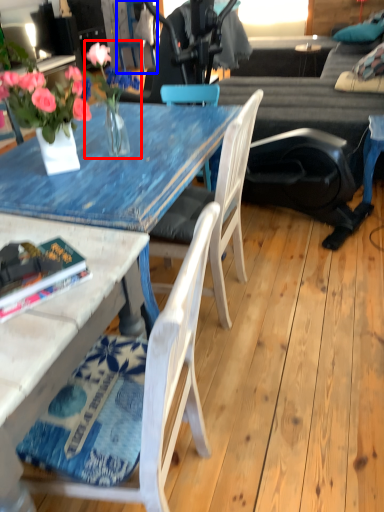
Question: Which object appears farthest to the camera in this image, floral arrangement (highlighted by a red box) or chair (highlighted by a blue box)?

Choices:
 (A) floral arrangement
 (B) chair

Answer: (B)